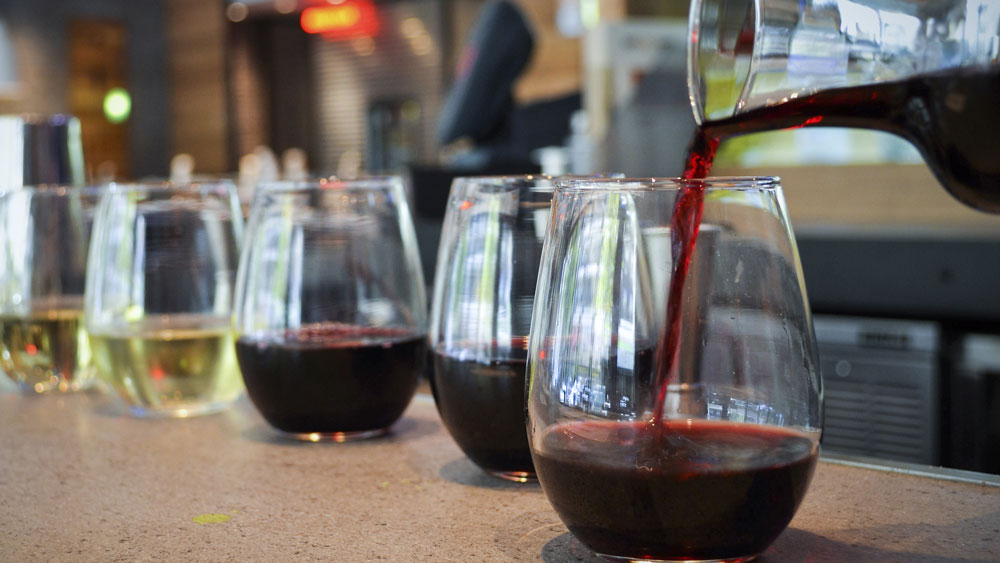
Where is `wine glass`? The height and width of the screenshot is (563, 1000). wine glass is located at coordinates (35, 265), (160, 275), (317, 271), (482, 302), (595, 336).